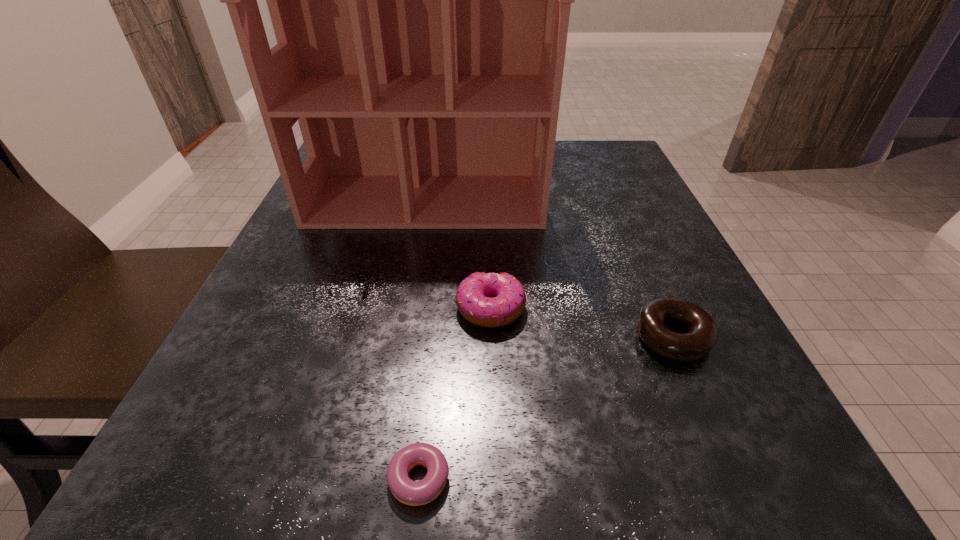
Where is `the farthest object`? the farthest object is located at coordinates (420, 0).

Locate an element on the screen. The image size is (960, 540). the tallest object is located at coordinates (420, 0).

Locate an element on the screen. Image resolution: width=960 pixels, height=540 pixels. the tallest doughnut is located at coordinates (490, 300).

Where is `the second shortest object`? Image resolution: width=960 pixels, height=540 pixels. the second shortest object is located at coordinates click(702, 333).

Identify the location of the second tallest doughnut. This screenshot has width=960, height=540. click(702, 333).

This screenshot has height=540, width=960. I want to click on the shortest doughnut, so click(x=409, y=492).

Find the location of a particular element. Image resolution: width=960 pixels, height=540 pixels. the nearest doughnut is located at coordinates (409, 492).

You are a GUI agent. You are given a task and a screenshot of the screen. Output one action in this format:
    pyautogui.click(x=<x>, y=<y>)
    Task: Click on the free spot located on the front-facing side of the tallest object
    Image resolution: width=960 pixels, height=540 pixels.
    Given the screenshot: What is the action you would take?
    pyautogui.click(x=415, y=266)

I want to click on vacant space located 0.350m on the back of the tallest doughnut, so click(488, 180).

Identify the location of vacant area situated 0.390m on the back of the rightmost object. The height and width of the screenshot is (540, 960). (606, 183).